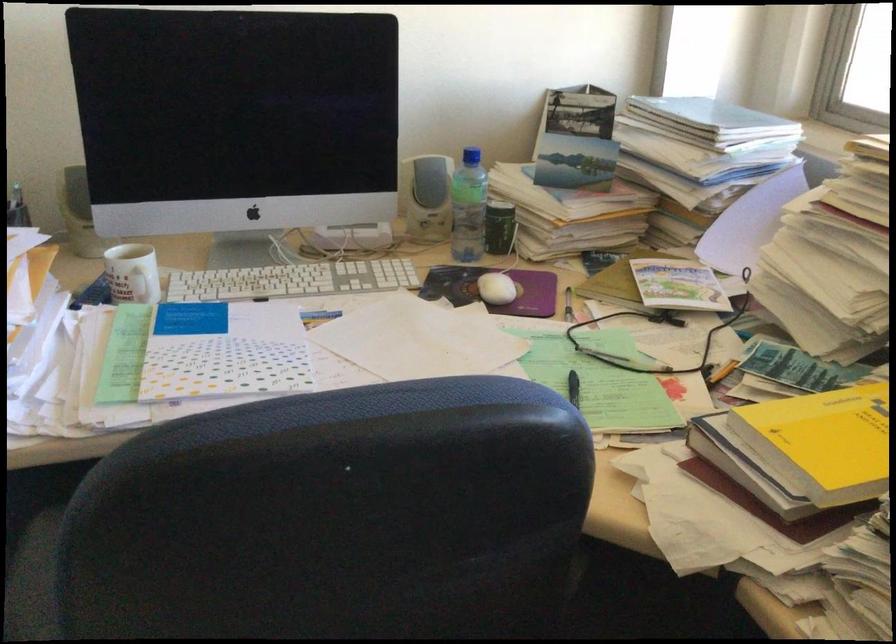
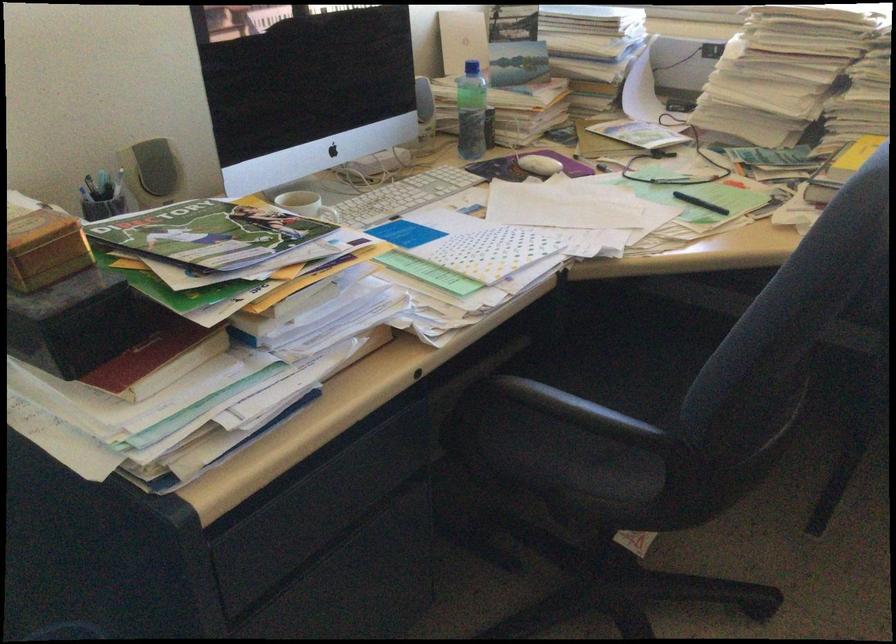
In the second image, find the point that corresponds to point 583,402 in the first image.

(700, 203)